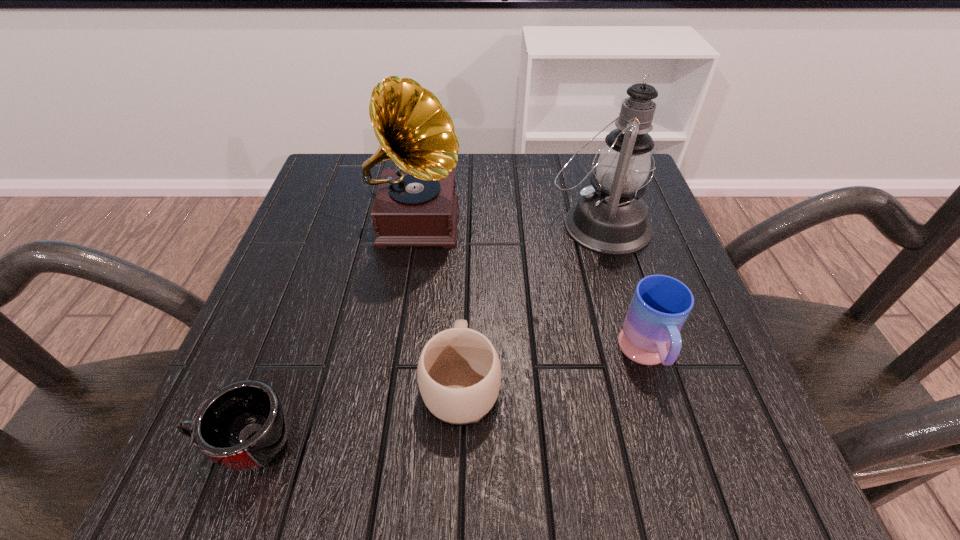
Select which mug is the closest to the oil lamp. Please provide its 2D coordinates. Your answer should be formatted as a tuple, i.e. [(x, y)], where the tuple contains the x and y coordinates of a point satisfying the conditions above.

[(660, 306)]

What are the coordinates of `vacant region that satisfies the following two spatial constraints: 1. on the side of the rightmost mug with the handle; 2. on the side of the leftmost mug with the handle` in the screenshot? It's located at (674, 444).

The height and width of the screenshot is (540, 960). In order to click on vacant region that satisfies the following two spatial constraints: 1. on the side of the third shortest object with the handle; 2. on the side of the leftmost object with the handle in this screenshot , I will do `click(674, 444)`.

At what (x,y) coordinates should I click in order to perform the action: click on vacant space that satisfies the following two spatial constraints: 1. on the side of the third shortest object with the handle; 2. on the side of the leftmost object with the handle. Please return your answer as a coordinate pair (x, y). This screenshot has height=540, width=960. Looking at the image, I should click on (674, 444).

The height and width of the screenshot is (540, 960). Find the location of `vacant area in the image that satisfies the following two spatial constraints: 1. on the front side of the oil lamp; 2. on the side of the leftmost mug with the handle`. vacant area in the image that satisfies the following two spatial constraints: 1. on the front side of the oil lamp; 2. on the side of the leftmost mug with the handle is located at coordinates (664, 444).

Identify the location of free space that satisfies the following two spatial constraints: 1. from the horn of the oil lamp; 2. on the right side of the phonograph record. (416, 225).

The height and width of the screenshot is (540, 960). Find the location of `vacant region that satisfies the following two spatial constraints: 1. from the horn of the phonograph record; 2. on the side of the leftmost object with the handle`. vacant region that satisfies the following two spatial constraints: 1. from the horn of the phonograph record; 2. on the side of the leftmost object with the handle is located at coordinates (381, 444).

The width and height of the screenshot is (960, 540). In order to click on vacant region that satisfies the following two spatial constraints: 1. on the side of the rightmost mug with the handle; 2. on the side of the leftmost object with the handle in this screenshot , I will do `click(674, 444)`.

You are a GUI agent. You are given a task and a screenshot of the screen. Output one action in this format:
    pyautogui.click(x=<x>, y=<y>)
    Task: Click on the vacant region that satisfies the following two spatial constraints: 1. on the side of the tallest mug with the handle; 2. on the side of the leftmost mug with the handle
    This screenshot has height=540, width=960.
    Given the screenshot: What is the action you would take?
    pyautogui.click(x=674, y=444)

Locate an element on the screen. free space that satisfies the following two spatial constraints: 1. on the front side of the oil lamp; 2. on the side of the leftmost object with the handle is located at coordinates (664, 444).